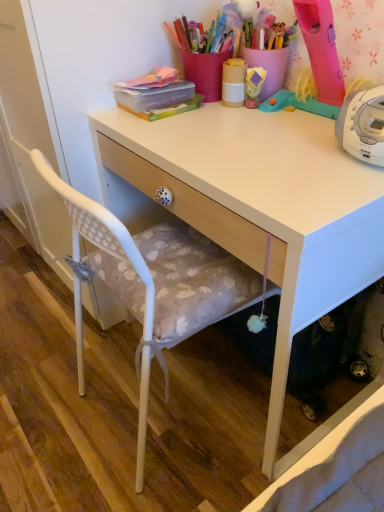
Question: Considering the relative sizes of matte yellow cup at upper center and white matte desk at center in the image provided, is matte yellow cup at upper center thinner than white matte desk at center?

Choices:
 (A) yes
 (B) no

Answer: (A)

Question: From the image's perspective, is matte yellow cup at upper center beneath white matte desk at center?

Choices:
 (A) yes
 (B) no

Answer: (B)

Question: Considering the relative positions of matte yellow cup at upper center and white matte desk at center in the image provided, is matte yellow cup at upper center to the right of white matte desk at center from the viewer's perspective?

Choices:
 (A) yes
 (B) no

Answer: (B)

Question: Considering the relative sizes of matte yellow cup at upper center and white matte desk at center in the image provided, is matte yellow cup at upper center shorter than white matte desk at center?

Choices:
 (A) no
 (B) yes

Answer: (B)

Question: Would you say matte yellow cup at upper center contains white matte desk at center?

Choices:
 (A) yes
 (B) no

Answer: (B)

Question: Looking at their shapes, would you say white plastic chair at left is wider or thinner than white matte desk at center?

Choices:
 (A) thin
 (B) wide

Answer: (A)

Question: Considering the relative positions of white plastic chair at left and white matte desk at center in the image provided, is white plastic chair at left to the left or to the right of white matte desk at center?

Choices:
 (A) right
 (B) left

Answer: (B)

Question: From a real-world perspective, relative to white matte desk at center, is white plastic chair at left vertically above or below?

Choices:
 (A) below
 (B) above

Answer: (B)

Question: From the image's perspective, relative to white matte desk at center, is white plastic chair at left above or below?

Choices:
 (A) above
 (B) below

Answer: (B)

Question: Would you say white matte desk at center is to the left or to the right of white plastic chair at left in the picture?

Choices:
 (A) right
 (B) left

Answer: (A)

Question: Is white matte desk at center in front of or behind white plastic chair at left in the image?

Choices:
 (A) front
 (B) behind

Answer: (B)

Question: Considering the positions of white matte desk at center and white plastic chair at left in the image, is white matte desk at center taller or shorter than white plastic chair at left?

Choices:
 (A) tall
 (B) short

Answer: (B)

Question: From the image's perspective, is white matte desk at center positioned above or below white plastic chair at left?

Choices:
 (A) above
 (B) below

Answer: (A)

Question: Considering the positions of white plastic chair at left and matte yellow cup at upper center in the image, is white plastic chair at left bigger or smaller than matte yellow cup at upper center?

Choices:
 (A) big
 (B) small

Answer: (A)

Question: Is point (200, 317) closer or farther from the camera than point (225, 70)?

Choices:
 (A) closer
 (B) farther

Answer: (A)